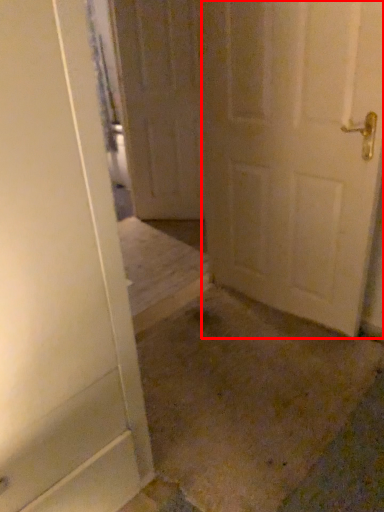
Question: From the image's perspective, what is the correct spatial relationship of door (annotated by the red box) in relation to door?

Choices:
 (A) below
 (B) above

Answer: (A)